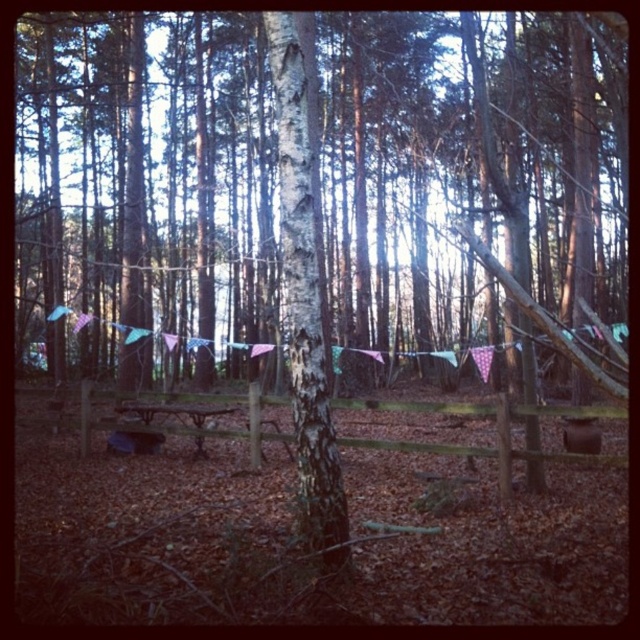
Which of these two, white bark tree at center or wooden picnic table at center, stands shorter?

With less height is wooden picnic table at center.

Measure the distance from white bark tree at center to wooden picnic table at center.

white bark tree at center is 6.42 meters from wooden picnic table at center.

Is point (310, 244) farther from camera compared to point (157, 403)?

That is False.

The width and height of the screenshot is (640, 640). What are the coordinates of `white bark tree at center` in the screenshot? It's located at coord(305,301).